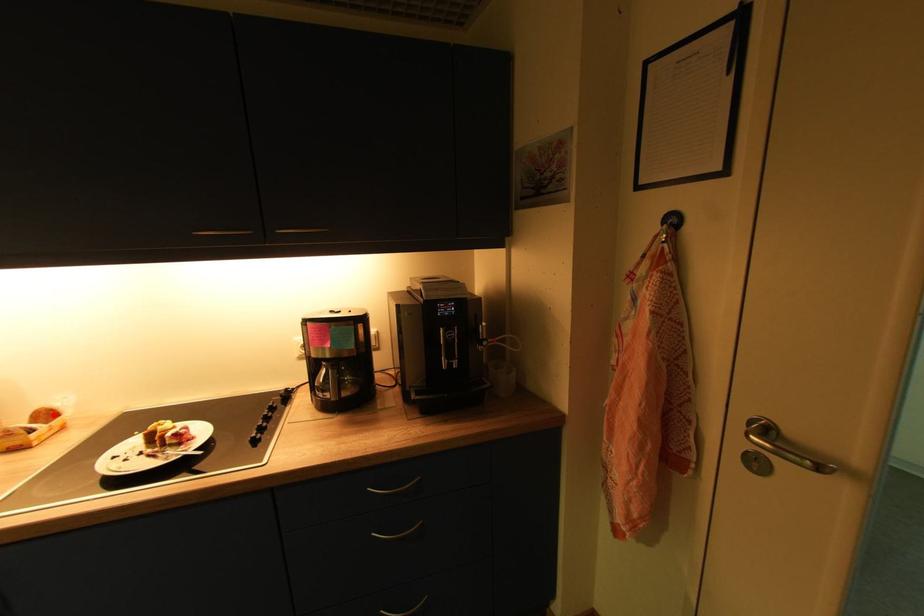
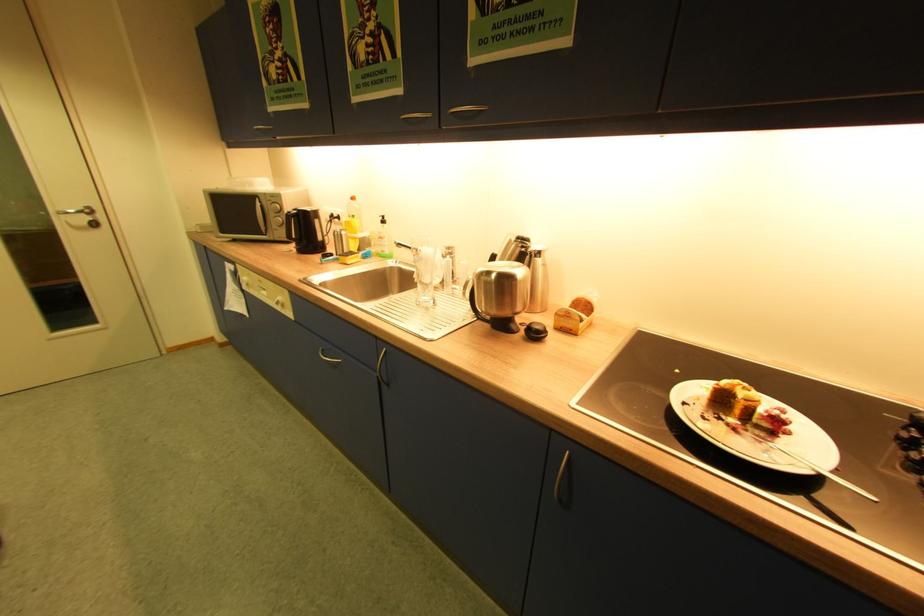
Locate, in the second image, the point that corresponds to the highlighted location in the first image.

(590, 306)